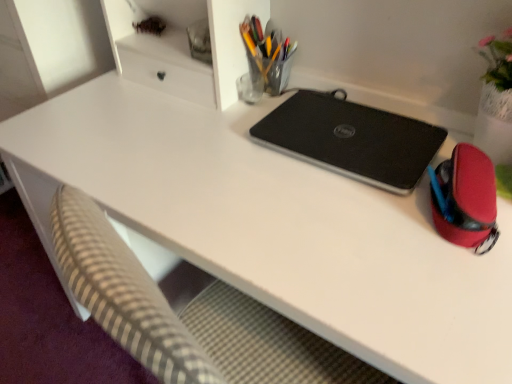
Question: Is translucent glass pen holder at upper center, the 2th stationery in the front-to-back sequence, facing away from black matte laptop at center?

Choices:
 (A) yes
 (B) no

Answer: (B)

Question: Can you confirm if translucent glass pen holder at upper center, which is the 1th stationery from top to bottom, is shorter than black matte laptop at center?

Choices:
 (A) yes
 (B) no

Answer: (B)

Question: Is the position of translucent glass pen holder at upper center, marked as the second stationery in a right-to-left arrangement, more distant than that of black matte laptop at center?

Choices:
 (A) yes
 (B) no

Answer: (A)

Question: Is translucent glass pen holder at upper center, arranged as the first stationery when viewed from the left, in front of black matte laptop at center?

Choices:
 (A) no
 (B) yes

Answer: (A)

Question: From the image's perspective, is translucent glass pen holder at upper center, positioned as the first stationery in back-to-front order, under black matte laptop at center?

Choices:
 (A) yes
 (B) no

Answer: (B)

Question: Is translucent glass pen holder at upper center, arranged as the first stationery when viewed from the left, next to black matte laptop at center?

Choices:
 (A) yes
 (B) no

Answer: (B)

Question: Is rubberized red pouch at right, arranged as the 1th stationery when viewed from the front, not inside translucent glass pen holder at upper center, marked as the second stationery in a right-to-left arrangement?

Choices:
 (A) yes
 (B) no

Answer: (A)

Question: Does rubberized red pouch at right, which is the 2th stationery in left-to-right order, have a greater width compared to translucent glass pen holder at upper center, marked as the second stationery in a right-to-left arrangement?

Choices:
 (A) no
 (B) yes

Answer: (B)

Question: Considering the relative positions of rubberized red pouch at right, arranged as the 1th stationery when viewed from the front, and translucent glass pen holder at upper center, the 2th stationery in the front-to-back sequence, in the image provided, is rubberized red pouch at right, arranged as the 1th stationery when viewed from the front, behind translucent glass pen holder at upper center, the 2th stationery in the front-to-back sequence,?

Choices:
 (A) no
 (B) yes

Answer: (A)

Question: From the image's perspective, is rubberized red pouch at right, the 1th stationery when ordered from right to left, over translucent glass pen holder at upper center, marked as the second stationery in a right-to-left arrangement?

Choices:
 (A) yes
 (B) no

Answer: (B)

Question: Considering the relative sizes of rubberized red pouch at right, which is the second stationery in back-to-front order, and translucent glass pen holder at upper center, marked as the second stationery in a right-to-left arrangement, in the image provided, is rubberized red pouch at right, which is the second stationery in back-to-front order, taller than translucent glass pen holder at upper center, marked as the second stationery in a right-to-left arrangement,?

Choices:
 (A) yes
 (B) no

Answer: (B)

Question: From a real-world perspective, is rubberized red pouch at right, which is the second stationery in back-to-front order, on top of translucent glass pen holder at upper center, positioned as the first stationery in back-to-front order?

Choices:
 (A) yes
 (B) no

Answer: (B)

Question: Is rubberized red pouch at right, which ranks as the second stationery in top-to-bottom order, facing towards black matte laptop at center?

Choices:
 (A) no
 (B) yes

Answer: (A)